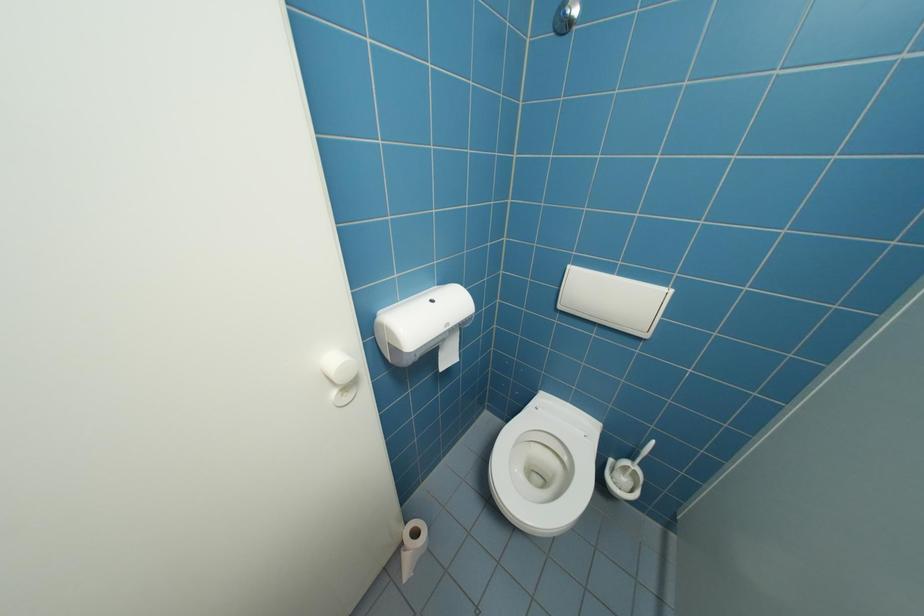
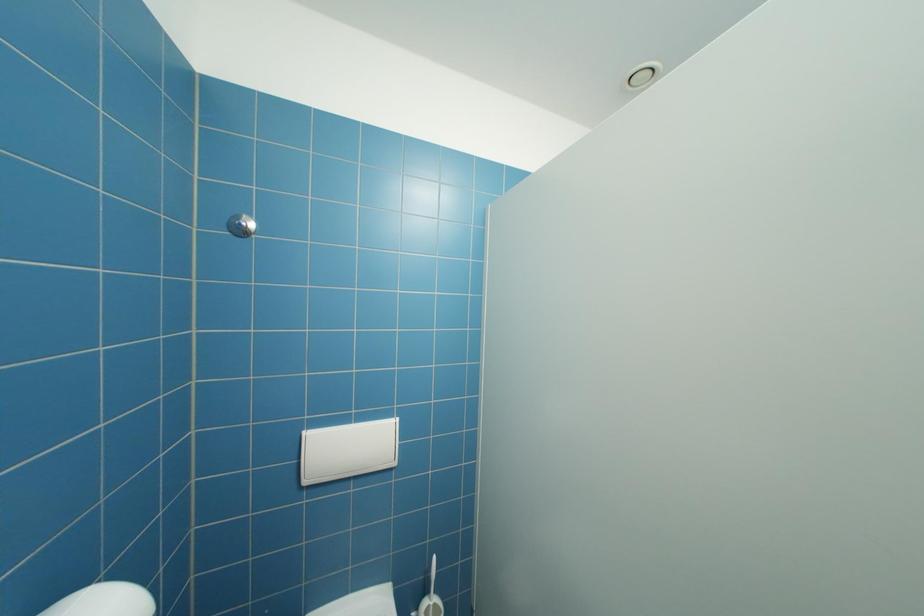
Question: The first image is from the beginning of the video and the second image is from the end. How did the camera likely rotate when shooting the video?

Choices:
 (A) Left
 (B) Right
 (C) Up
 (D) Down

Answer: (B)